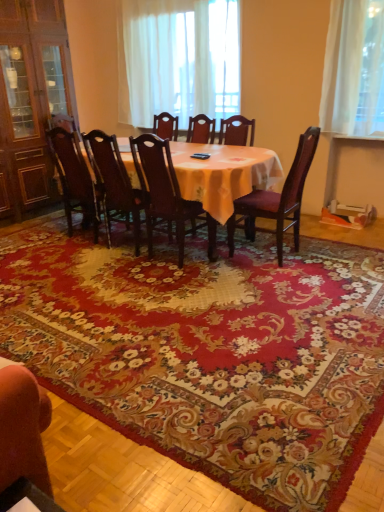
Locate an element on the screen. vacant space in front of wooden chair with purple cushion at right, the fifth chair when ordered from left to right is located at coordinates (273, 282).